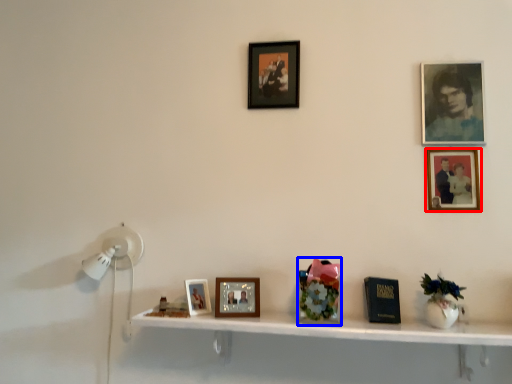
Question: Which of the following is the farthest to the observer, picture frame (highlighted by a red box) or art (highlighted by a blue box)?

Choices:
 (A) picture frame
 (B) art

Answer: (A)